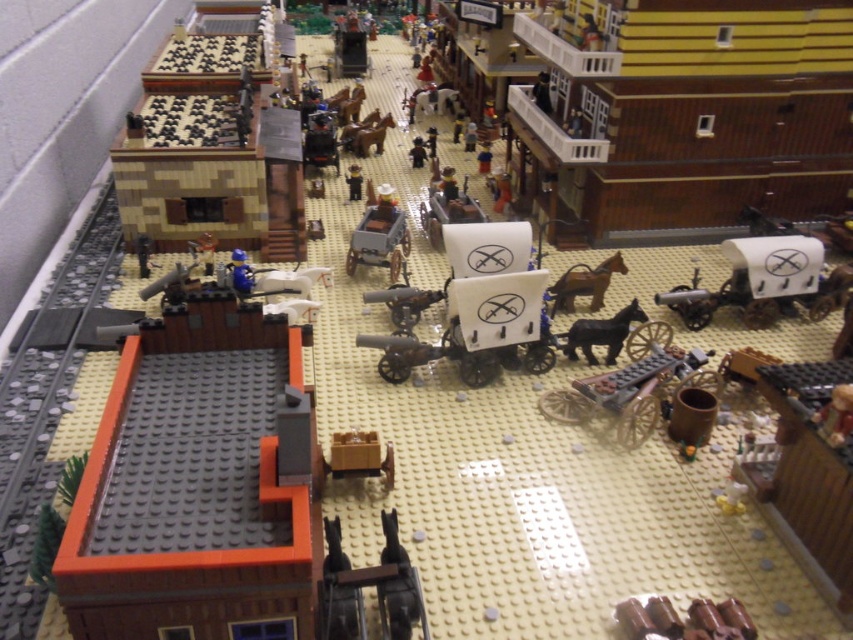
Question: Considering the real-world distances, which object is farthest from the black matte horse at center-right?

Choices:
 (A) brown matte horse at center
 (B) matte gray wagon at center
 (C) brown matte wagon at center-right

Answer: (B)

Question: Considering the relative positions of brown matte wagon at center-right and white matte wagon at center in the image provided, where is brown matte wagon at center-right located with respect to white matte wagon at center?

Choices:
 (A) left
 (B) right

Answer: (B)

Question: Estimate the real-world distances between objects in this image. Which object is farther from the smooth brown cowboy hat at center?

Choices:
 (A) black matte horse at center-right
 (B) brown matte horse at center
 (C) white matte wagon at center

Answer: (A)

Question: Does matte gray wagon at center have a smaller size compared to smooth brown cowboy hat at center?

Choices:
 (A) no
 (B) yes

Answer: (A)

Question: Can you confirm if brown matte wagon at center-right is positioned to the left of matte gray wagon at center?

Choices:
 (A) yes
 (B) no

Answer: (B)

Question: Which object is farther from the camera taking this photo?

Choices:
 (A) brown matte horse at center
 (B) black matte horse at center-right
 (C) white matte wagon at center
 (D) blue plastic figure at center-left

Answer: (C)